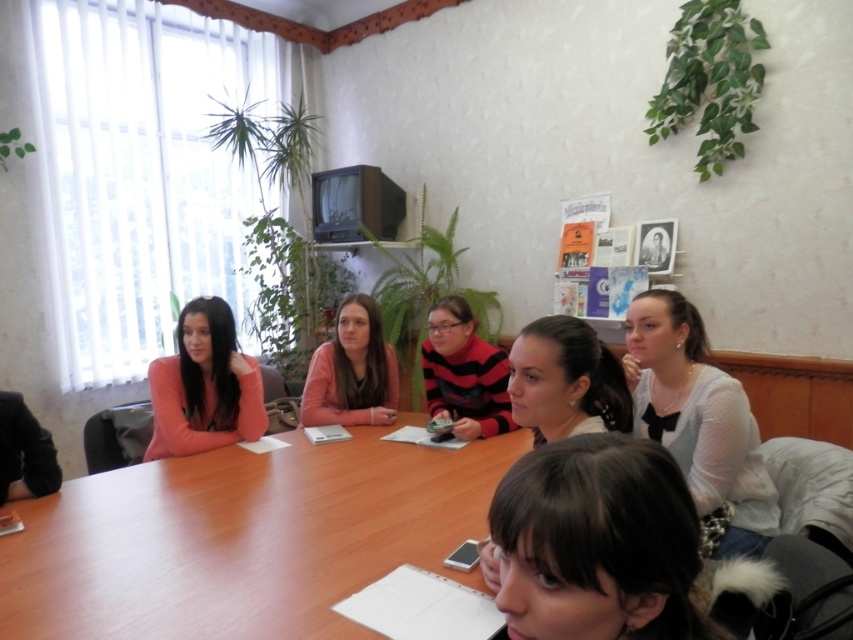
Question: Among these points, which one is nearest to the camera?

Choices:
 (A) (566, 388)
 (B) (740, 413)
 (C) (689, 556)
 (D) (344, 413)

Answer: (C)

Question: Can you confirm if wooden table at center is smaller than striped sweater at center?

Choices:
 (A) no
 (B) yes

Answer: (A)

Question: Which of the following is the farthest from the observer?

Choices:
 (A) (628, 566)
 (B) (380, 380)
 (C) (73, 525)
 (D) (192, 404)

Answer: (B)

Question: Which of the following is the farthest from the observer?

Choices:
 (A) striped sweater at center
 (B) wooden table at center

Answer: (A)

Question: Can you confirm if wooden table at center is positioned to the right of striped sweater at center?

Choices:
 (A) yes
 (B) no

Answer: (B)

Question: Considering the relative positions of wooden table at center and smooth brown hair at center in the image provided, where is wooden table at center located with respect to smooth brown hair at center?

Choices:
 (A) left
 (B) right

Answer: (A)